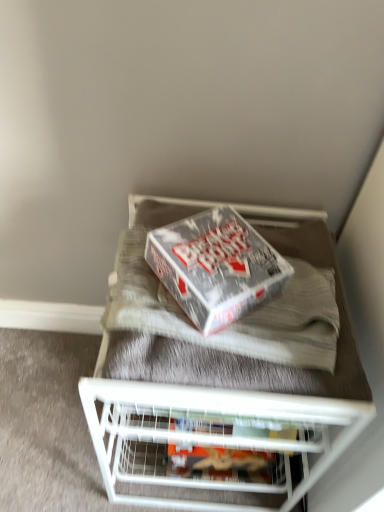
Question: From the image's perspective, is white metal shelf at upper center below silver metallic box at center?

Choices:
 (A) no
 (B) yes

Answer: (B)

Question: Are white metal shelf at upper center and silver metallic box at center located far from each other?

Choices:
 (A) no
 (B) yes

Answer: (A)

Question: Is the position of white metal shelf at upper center less distant than that of silver metallic box at center?

Choices:
 (A) yes
 (B) no

Answer: (B)

Question: Is white metal shelf at upper center facing towards silver metallic box at center?

Choices:
 (A) yes
 (B) no

Answer: (B)

Question: Is white metal shelf at upper center next to silver metallic box at center and touching it?

Choices:
 (A) yes
 (B) no

Answer: (B)

Question: Can you confirm if white metal shelf at upper center is positioned to the right of silver metallic box at center?

Choices:
 (A) no
 (B) yes

Answer: (A)

Question: Is white metal shelf at upper center facing towards matte cardboard box at center?

Choices:
 (A) no
 (B) yes

Answer: (B)

Question: From a real-world perspective, is white metal shelf at upper center on matte cardboard box at center?

Choices:
 (A) no
 (B) yes

Answer: (B)

Question: From the image's perspective, would you say white metal shelf at upper center is shown under matte cardboard box at center?

Choices:
 (A) yes
 (B) no

Answer: (B)

Question: Can you confirm if white metal shelf at upper center is taller than matte cardboard box at center?

Choices:
 (A) yes
 (B) no

Answer: (A)

Question: Does white metal shelf at upper center have a lesser height compared to matte cardboard box at center?

Choices:
 (A) yes
 (B) no

Answer: (B)

Question: From the image's perspective, is white metal shelf at upper center on matte cardboard box at center?

Choices:
 (A) no
 (B) yes

Answer: (B)

Question: Does white metal shelf at upper center have a greater width compared to white wire shelf at center?

Choices:
 (A) no
 (B) yes

Answer: (A)